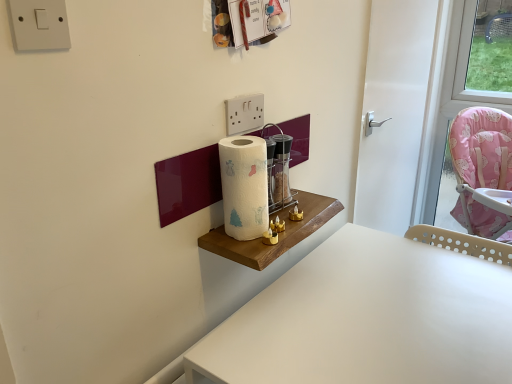
This screenshot has height=384, width=512. I want to click on vacant area located to the right-hand side of white paper towel at center, so click(x=300, y=220).